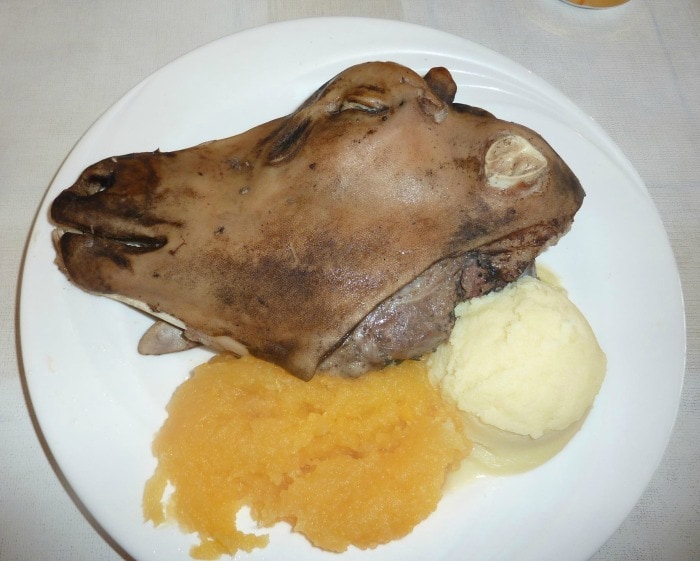
Find the location of a particular element. The width and height of the screenshot is (700, 561). plate is located at coordinates (626, 302).